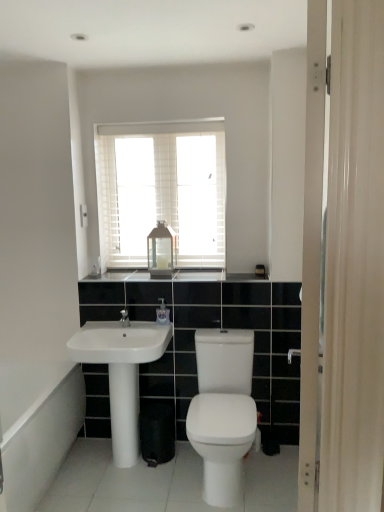
Question: Is white glossy bidet at center surrounding white glossy sink at lower left?

Choices:
 (A) no
 (B) yes

Answer: (A)

Question: Is white glossy bidet at center with white glossy sink at lower left?

Choices:
 (A) yes
 (B) no

Answer: (B)

Question: Considering the relative sizes of white glossy bidet at center and white glossy sink at lower left in the image provided, is white glossy bidet at center smaller than white glossy sink at lower left?

Choices:
 (A) no
 (B) yes

Answer: (A)

Question: Can you confirm if white glossy bidet at center is positioned to the right of white glossy sink at lower left?

Choices:
 (A) no
 (B) yes

Answer: (B)

Question: Does white glossy bidet at center have a larger size compared to white glossy sink at lower left?

Choices:
 (A) no
 (B) yes

Answer: (B)

Question: Could you tell me if white glossy bidet at center is turned towards white glossy sink at lower left?

Choices:
 (A) no
 (B) yes

Answer: (A)

Question: Is white glossy bath at lower left at the right side of clear plastic soap dispenser at center?

Choices:
 (A) no
 (B) yes

Answer: (A)

Question: From the image's perspective, is white glossy bath at lower left under clear plastic soap dispenser at center?

Choices:
 (A) yes
 (B) no

Answer: (A)

Question: Does white glossy bath at lower left have a greater height compared to clear plastic soap dispenser at center?

Choices:
 (A) yes
 (B) no

Answer: (A)

Question: Would you say clear plastic soap dispenser at center is part of white glossy bath at lower left's contents?

Choices:
 (A) no
 (B) yes

Answer: (A)

Question: Is white glossy bath at lower left wider than clear plastic soap dispenser at center?

Choices:
 (A) yes
 (B) no

Answer: (A)

Question: Does white glossy bath at lower left have a larger size compared to clear plastic soap dispenser at center?

Choices:
 (A) yes
 (B) no

Answer: (A)

Question: Does white wooden blinds at upper center lie in front of white glossy pillar at center?

Choices:
 (A) no
 (B) yes

Answer: (A)